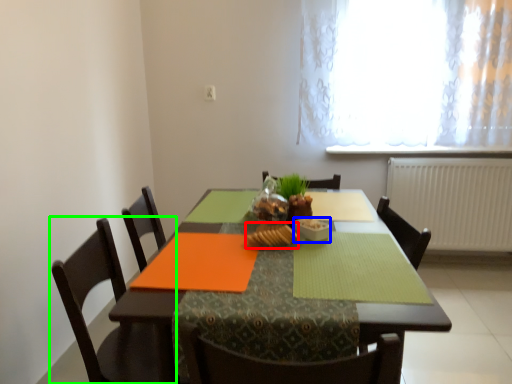
Question: Estimate the real-world distances between objects in this image. Which object is farther from food (highlighted by a red box), tableware (highlighted by a blue box) or chair (highlighted by a green box)?

Choices:
 (A) tableware
 (B) chair

Answer: (B)